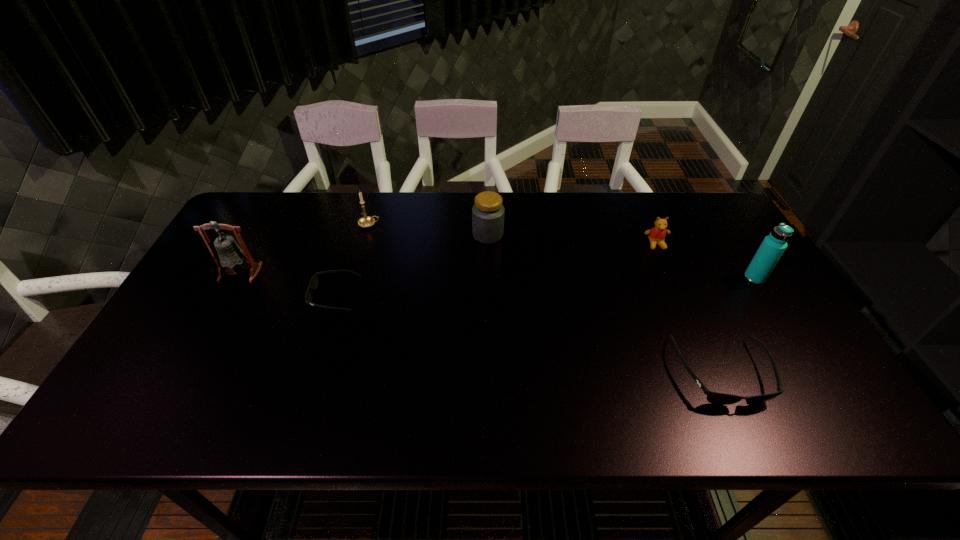
Where is `blank region between the fifth tallest object and the water bottle`? blank region between the fifth tallest object and the water bottle is located at coordinates (706, 261).

Locate an element on the screen. This screenshot has width=960, height=540. vacant area between the jar and the rightmost object is located at coordinates (621, 256).

Image resolution: width=960 pixels, height=540 pixels. I want to click on free spot between the candle holder and the teddy bear, so click(513, 234).

Locate which object is the fourth closest to the teddy bear. Please provide its 2D coordinates. Your answer should be formatted as a tuple, i.e. [(x, y)], where the tuple contains the x and y coordinates of a point satisfying the conditions above.

[(366, 221)]

I want to click on object that is the fourth nearest to the candle holder, so click(656, 235).

Find the location of `blank space that satisfies the following two spatial constraints: 1. on the front-facing side of the teddy bear; 2. on the front-facing side of the left sunglasses`. blank space that satisfies the following two spatial constraints: 1. on the front-facing side of the teddy bear; 2. on the front-facing side of the left sunglasses is located at coordinates (678, 295).

Where is `vacant area in the image that satisfies the following two spatial constraints: 1. on the back side of the rightmost object; 2. on the surface of the fourth object from right to left near the warning symbol`? The image size is (960, 540). vacant area in the image that satisfies the following two spatial constraints: 1. on the back side of the rightmost object; 2. on the surface of the fourth object from right to left near the warning symbol is located at coordinates (728, 235).

This screenshot has width=960, height=540. Identify the location of blank area in the image that satisfies the following two spatial constraints: 1. on the back side of the rightmost object; 2. on the surface of the fourth object from left to right near the warning symbol. (728, 235).